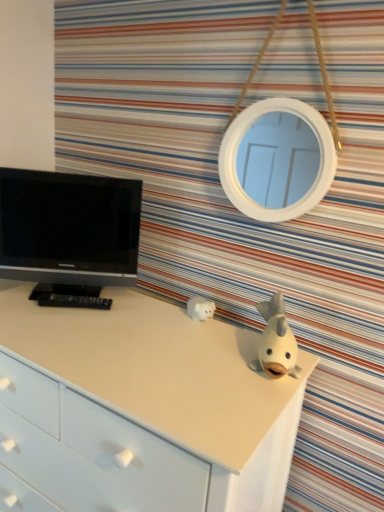
You are a GUI agent. You are given a task and a screenshot of the screen. Output one action in this format:
    pyautogui.click(x=<x>, y=<y>)
    Task: Click on the free location to the left of white matte piggy bank at center, which is counted as the first toy, starting from the left
    This screenshot has height=512, width=384.
    Given the screenshot: What is the action you would take?
    pyautogui.click(x=150, y=312)